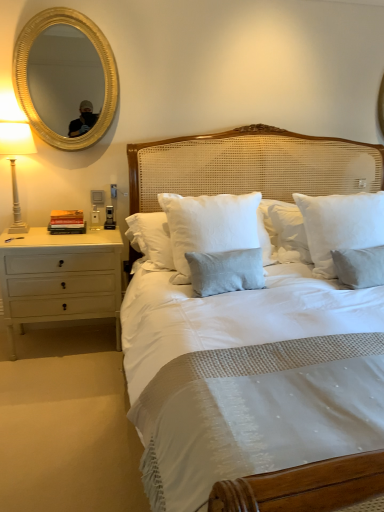
Locate an element on the screen. The height and width of the screenshot is (512, 384). free space above white wood nightstand at left (from a real-world perspective) is located at coordinates (62, 232).